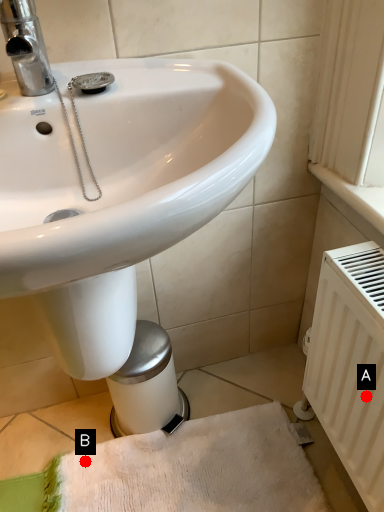
Question: Two points are circled on the image, labeled by A and B beside each circle. Which of the following is the closest to the observer?

Choices:
 (A) A is closer
 (B) B is closer

Answer: (A)